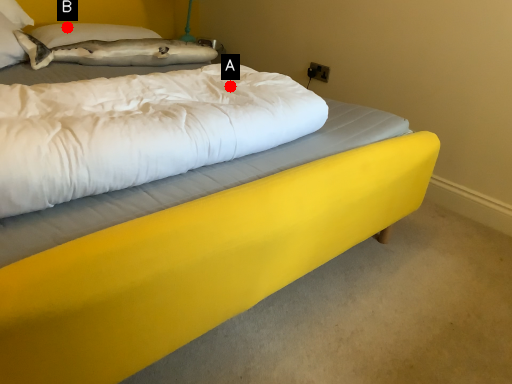
Question: Two points are circled on the image, labeled by A and B beside each circle. Which point appears farthest from the camera in this image?

Choices:
 (A) A is further
 (B) B is further

Answer: (B)